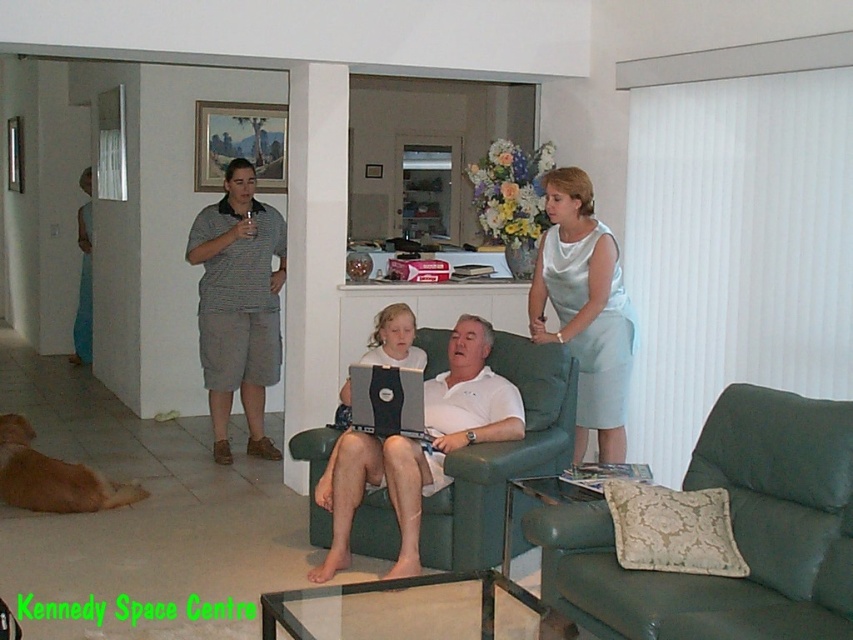
Does white matte laptop at center appear under striped cotton shirt at left?

Correct, white matte laptop at center is located below striped cotton shirt at left.

Who is more distant from viewer, (486, 344) or (202, 333)?

Point (202, 333)

Is point (390, 444) less distant than point (224, 433)?

That is True.

Where is `white matte laptop at center`? white matte laptop at center is located at coordinates (419, 449).

Is striped cotton shirt at left positioned in front of light blue satin dress at right?

No, it is not.

Who is positioned more to the left, striped cotton shirt at left or light blue satin dress at right?

Positioned to the left is striped cotton shirt at left.

Image resolution: width=853 pixels, height=640 pixels. Identify the location of striped cotton shirt at left. (238, 305).

At what (x,y) coordinates should I click in order to perform the action: click on striped cotton shirt at left. Please return your answer as a coordinate pair (x, y). This screenshot has height=640, width=853. Looking at the image, I should click on (238, 305).

Who is higher up, light blue satin dress at right or matte black laptop at center?

light blue satin dress at right

Which is behind, point (537, 276) or point (368, 355)?

The point (537, 276) is behind.

Between point (556, 202) and point (390, 332), which one is positioned behind?

The point (556, 202) is behind.

At what (x,y) coordinates should I click in order to perform the action: click on light blue satin dress at right. Please return your answer as a coordinate pair (x, y). The image size is (853, 640). Looking at the image, I should click on (584, 308).